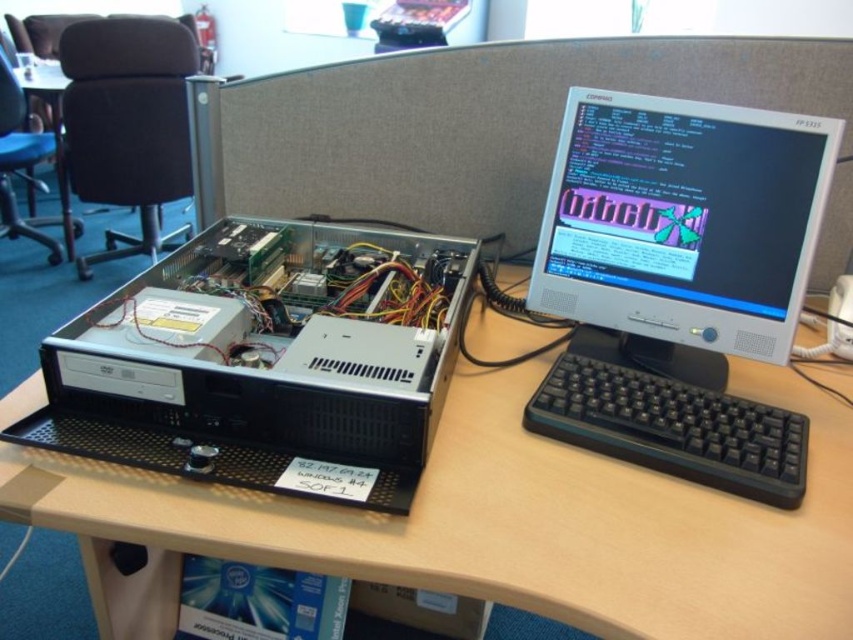
Question: Which object is farther from the camera taking this photo?

Choices:
 (A) black plastic keyboard at lower right
 (B) wooden desk at lower left

Answer: (B)

Question: Where is silver metallic computer case at left located in relation to black plastic keyboard at lower right in the image?

Choices:
 (A) above
 (B) below

Answer: (A)

Question: Which object appears farthest from the camera in this image?

Choices:
 (A) matte silver monitor at upper right
 (B) wooden desk at lower left

Answer: (B)

Question: Can you confirm if black plastic computer desk at center is wider than silver metallic computer case at left?

Choices:
 (A) yes
 (B) no

Answer: (A)

Question: Which object is the farthest from the wooden desk at lower left?

Choices:
 (A) silver metallic computer case at left
 (B) black plastic computer desk at center

Answer: (B)

Question: Can you confirm if silver metallic computer case at left is positioned below matte silver monitor at upper right?

Choices:
 (A) no
 (B) yes

Answer: (B)